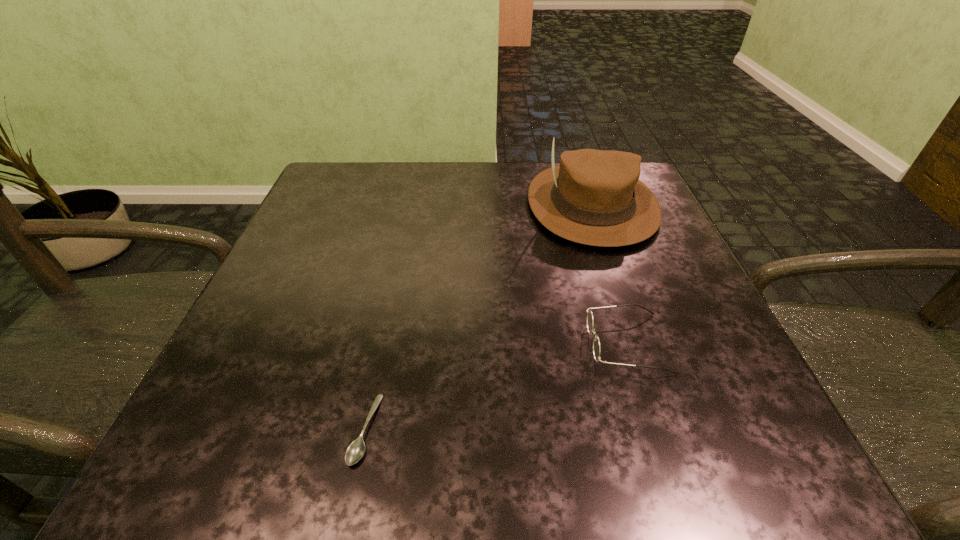
At what (x,y) coordinates should I click in order to perform the action: click on vacant space that satisfies the following two spatial constraints: 1. on the feather side of the farthest object; 2. through the lenses of the second nearest object. Please return your answer as a coordinate pair (x, y). Image resolution: width=960 pixels, height=540 pixels. Looking at the image, I should click on (639, 343).